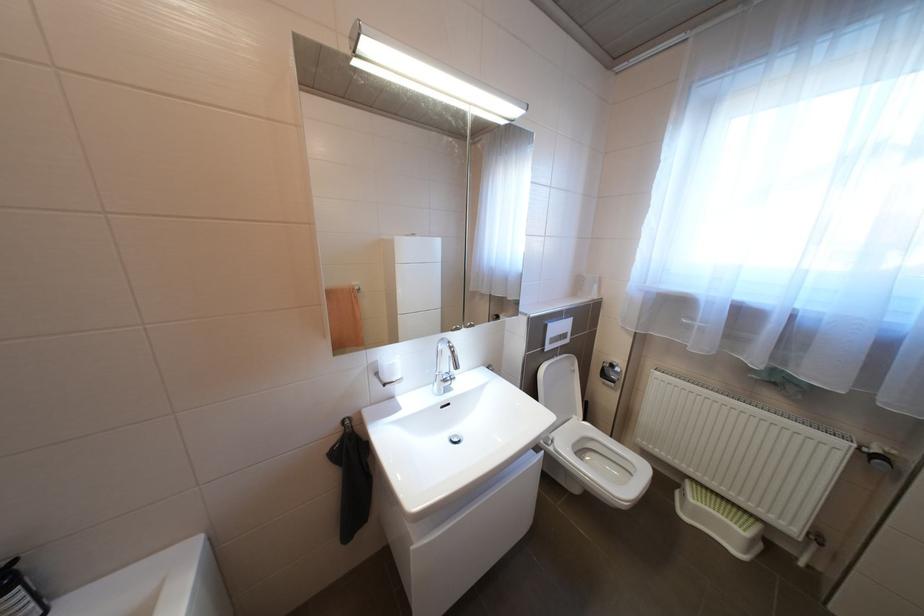
The height and width of the screenshot is (616, 924). What do you see at coordinates (608, 467) in the screenshot?
I see `the white toilet seat` at bounding box center [608, 467].